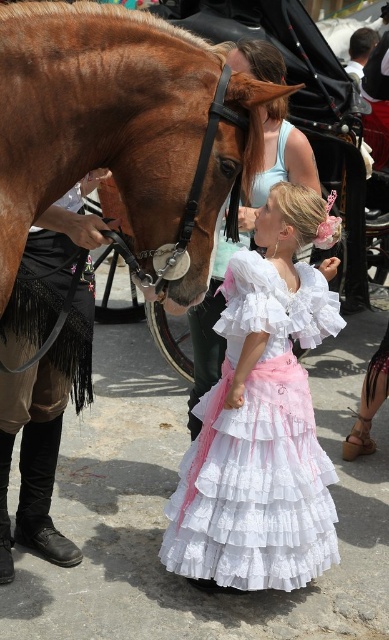
Who is lower down, shiny brown horse at left or white lace dress at center?

white lace dress at center

Does shiny brown horse at left have a larger size compared to white lace dress at center?

Actually, shiny brown horse at left might be smaller than white lace dress at center.

The width and height of the screenshot is (389, 640). Describe the element at coordinates (122, 128) in the screenshot. I see `shiny brown horse at left` at that location.

What are the coordinates of `shiny brown horse at left` in the screenshot? It's located at (122, 128).

Who is higher up, white lace dress at center or matte white blouse at center?

matte white blouse at center is higher up.

Locate an element on the screen. Image resolution: width=389 pixels, height=640 pixels. white lace dress at center is located at coordinates (259, 445).

Is point (198, 132) closer to viewer compared to point (187, 412)?

Yes, point (198, 132) is closer to viewer.

The width and height of the screenshot is (389, 640). What are the coordinates of `shiny brown horse at left` in the screenshot? It's located at (122, 128).